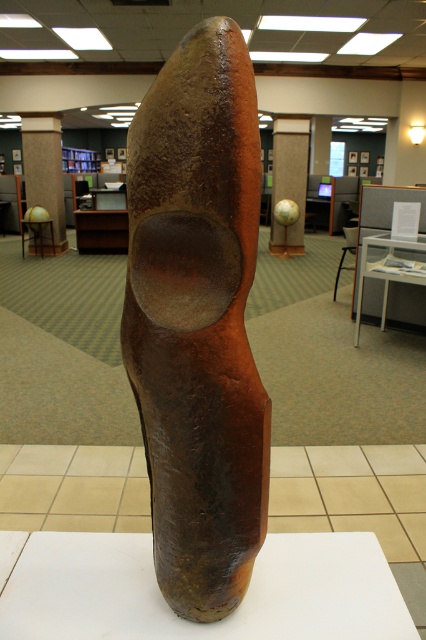
Question: Observing the image, what is the correct spatial positioning of brown textured pillar at center in reference to matte brown globe at center?

Choices:
 (A) left
 (B) right

Answer: (A)

Question: Which object is closer to the camera taking this photo?

Choices:
 (A) rusty metal sculpture at center
 (B) matte brown globe at center

Answer: (A)

Question: Is rusty metal sculpture at center wider than brown textured pillar at center?

Choices:
 (A) yes
 (B) no

Answer: (B)

Question: Estimate the real-world distances between objects in this image. Which object is closer to the matte brown globe at center?

Choices:
 (A) rusty metal sculpture at center
 (B) brown textured pillar at center

Answer: (B)

Question: Estimate the real-world distances between objects in this image. Which object is farther from the rusty metal sculpture at center?

Choices:
 (A) matte brown globe at center
 (B) brown textured pillar at center

Answer: (B)

Question: Is rusty metal sculpture at center below brown textured pillar at center?

Choices:
 (A) yes
 (B) no

Answer: (A)